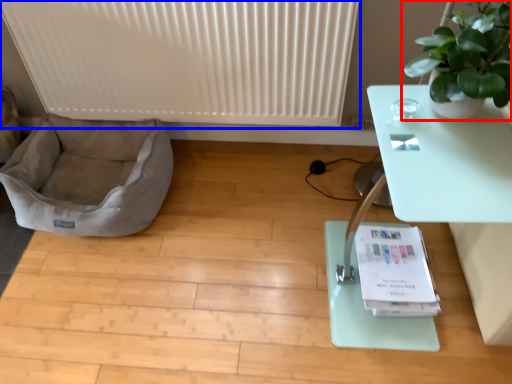
Question: Which point is closer to the camera, houseplant (highlighted by a red box) or radiator (highlighted by a blue box)?

Choices:
 (A) houseplant
 (B) radiator

Answer: (A)